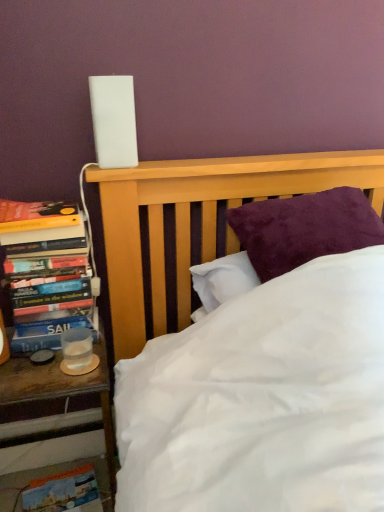
The height and width of the screenshot is (512, 384). Identify the location of free point in front of hardcover books at left. (39, 369).